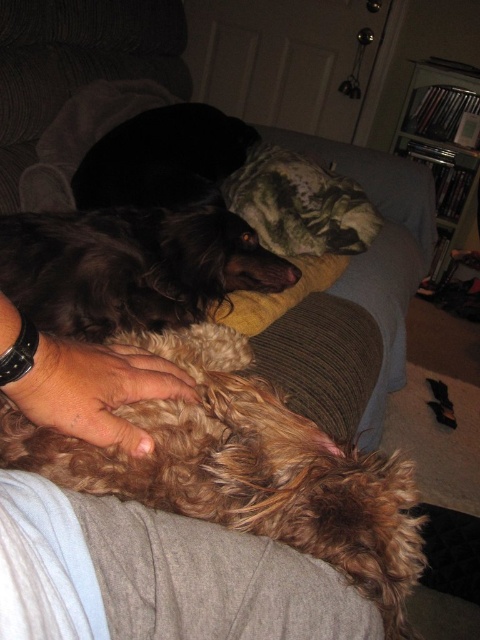
You are an interior designer planning to place a new lamp on the couch where the brown curly fur dog at center is currently resting. To avoid disturbing the dog, where should you position the lamp relative to the dog?

The brown curly fur dog at center is located at point (247, 470). To avoid disturbing the dog, the lamp should be placed away from this position, ensuring it does not encroach on the dog s resting spot.

You are a delivery person standing at the entrance of the apartment. You need to place a package on the floor at point (342, 636). The package is 18 inches wide. Will the package fit entirely within the space available at that point?

The distance of point (342, 636) from the camera is 19.31 inches. Since the package is 18 inches wide, it will fit as the available space is slightly larger than the package width.

Looking at the image, where is the brown furry dog at center in relation to the fuzzy brown fur at lower center?

The brown furry dog at center is to the right of the fuzzy brown fur at lower center.